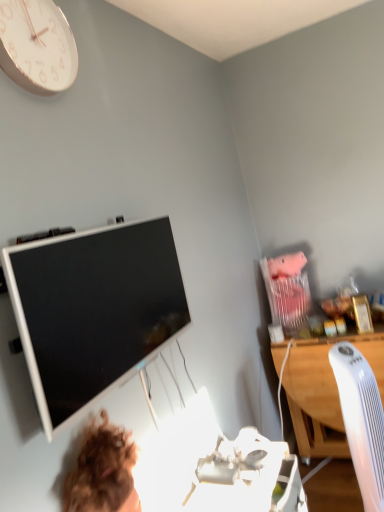
Question: Considering the relative sizes of white wood desk at right and white plastic computer chair at right in the image provided, is white wood desk at right shorter than white plastic computer chair at right?

Choices:
 (A) no
 (B) yes

Answer: (B)

Question: From a real-world perspective, is white wood desk at right physically above white plastic computer chair at right?

Choices:
 (A) yes
 (B) no

Answer: (B)

Question: Is white wood desk at right positioned with its back to white plastic computer chair at right?

Choices:
 (A) no
 (B) yes

Answer: (A)

Question: From a real-world perspective, is white wood desk at right physically below white plastic computer chair at right?

Choices:
 (A) no
 (B) yes

Answer: (B)

Question: Is white wood desk at right not near white plastic computer chair at right?

Choices:
 (A) no
 (B) yes

Answer: (A)

Question: Is the depth of white wood desk at right less than that of white plastic computer chair at right?

Choices:
 (A) no
 (B) yes

Answer: (A)

Question: Considering the relative sizes of white glossy television at upper left and white glossy clock at upper left in the image provided, is white glossy television at upper left thinner than white glossy clock at upper left?

Choices:
 (A) no
 (B) yes

Answer: (A)

Question: From a real-world perspective, is white glossy television at upper left on top of white glossy clock at upper left?

Choices:
 (A) yes
 (B) no

Answer: (B)

Question: Does white glossy television at upper left have a greater height compared to white glossy clock at upper left?

Choices:
 (A) yes
 (B) no

Answer: (A)

Question: Can you confirm if white glossy television at upper left is wider than white glossy clock at upper left?

Choices:
 (A) yes
 (B) no

Answer: (A)

Question: Is white glossy television at upper left outside white glossy clock at upper left?

Choices:
 (A) no
 (B) yes

Answer: (B)

Question: Does white glossy television at upper left have a smaller size compared to white glossy clock at upper left?

Choices:
 (A) yes
 (B) no

Answer: (B)

Question: Is white glossy clock at upper left thinner than white wood desk at right?

Choices:
 (A) yes
 (B) no

Answer: (A)